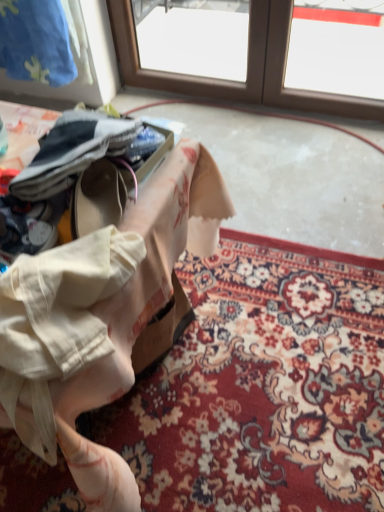
The width and height of the screenshot is (384, 512). What do you see at coordinates (99, 324) in the screenshot? I see `floral fabric at center` at bounding box center [99, 324].

Where is `floral fabric at center`? floral fabric at center is located at coordinates (99, 324).

The height and width of the screenshot is (512, 384). What are the coordinates of `floral carpet at lower center` in the screenshot? It's located at (262, 387).

Image resolution: width=384 pixels, height=512 pixels. What do you see at coordinates (262, 387) in the screenshot? I see `floral carpet at lower center` at bounding box center [262, 387].

Where is `floral fabric at center`? floral fabric at center is located at coordinates (99, 324).

Which object is positioned more to the right, floral fabric at center or floral carpet at lower center?

From the viewer's perspective, floral carpet at lower center appears more on the right side.

Is the depth of floral fabric at center less than that of floral carpet at lower center?

Yes, floral fabric at center is closer to the camera.

Which is less distant, [89,305] or [240,308]?

The point [89,305] is more forward.

From the image's perspective, is floral fabric at center above floral carpet at lower center?

Yes, from the image's perspective, floral fabric at center is over floral carpet at lower center.

From a real-world perspective, which object rests below the other?

In real-world perspective, floral carpet at lower center is lower.

Is floral fabric at center wider than floral carpet at lower center?

Incorrect, the width of floral fabric at center does not surpass that of floral carpet at lower center.

From the picture: Is floral fabric at center taller than floral carpet at lower center?

Yes.

Based on the photo, is floral fabric at center bigger than floral carpet at lower center?

Yes.

Is floral fabric at center completely or partially outside of floral carpet at lower center?

floral fabric at center lies outside floral carpet at lower center's area.

Are floral fabric at center and floral carpet at lower center far apart?

floral fabric at center is actually quite close to floral carpet at lower center.

Is floral fabric at center turned away from floral carpet at lower center?

floral fabric at center does not have its back to floral carpet at lower center.

What's the angular difference between floral fabric at center and floral carpet at lower center's facing directions?

The angular difference between floral fabric at center and floral carpet at lower center is 179 degrees.

The width and height of the screenshot is (384, 512). Find the location of `table located above the floral carpet at lower center (from a real-world perspective)`. table located above the floral carpet at lower center (from a real-world perspective) is located at coordinates [x=99, y=324].

Which is more to the right, floral carpet at lower center or floral fabric at center?

floral carpet at lower center.

Is floral carpet at lower center positioned in front of floral fabric at center?

No, floral carpet at lower center is behind floral fabric at center.

Is point (187, 451) less distant than point (118, 310)?

That is False.

Consider the image. From the image's perspective, between floral carpet at lower center and floral fabric at center, who is located below?

floral carpet at lower center appears lower in the image.

From a real-world perspective, which object stands above the other?

floral fabric at center is physically above.

Can you confirm if floral carpet at lower center is thinner than floral fabric at center?

In fact, floral carpet at lower center might be wider than floral fabric at center.

Does floral carpet at lower center have a greater height compared to floral fabric at center?

No.

Does floral carpet at lower center have a larger size compared to floral fabric at center?

Incorrect, floral carpet at lower center is not larger than floral fabric at center.

Is floral carpet at lower center positioned beyond the bounds of floral fabric at center?

floral carpet at lower center is positioned outside floral fabric at center.

Is floral carpet at lower center positioned far away from floral fabric at center?

No, floral carpet at lower center is not far away from floral fabric at center.

Is floral carpet at lower center looking in the opposite direction of floral fabric at center?

That's not correct — floral carpet at lower center is not looking away from floral fabric at center.

How many degrees apart are the facing directions of floral carpet at lower center and floral fabric at center?

The facing directions of floral carpet at lower center and floral fabric at center are 179 degrees apart.

The width and height of the screenshot is (384, 512). I want to click on mat beneath the floral fabric at center (from a real-world perspective), so click(262, 387).

Locate an element on the screen. Image resolution: width=384 pixels, height=512 pixels. table above the floral carpet at lower center (from a real-world perspective) is located at coordinates pyautogui.click(x=99, y=324).

Locate an element on the screen. This screenshot has width=384, height=512. table on the left of floral carpet at lower center is located at coordinates (99, 324).